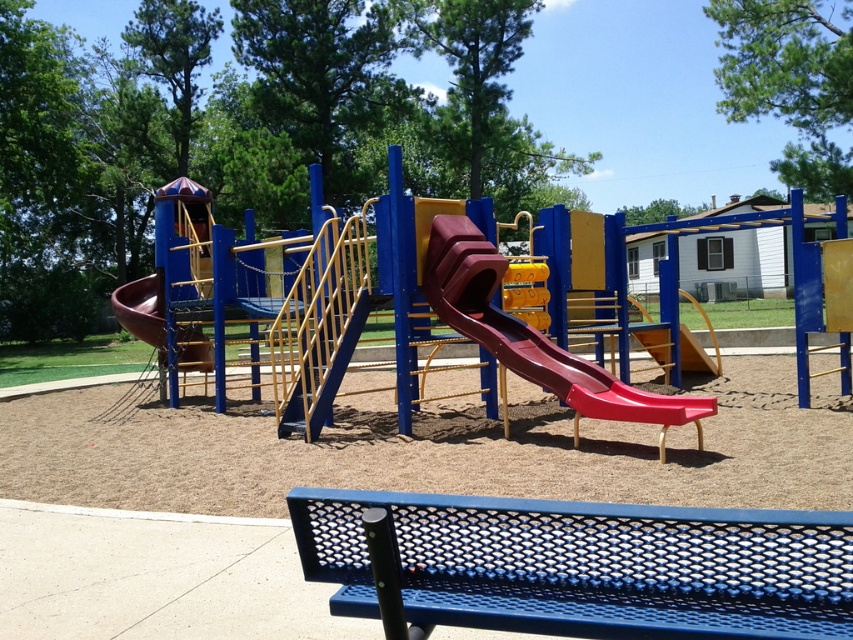
Identify the location of blue perforated metal bench at center. The height and width of the screenshot is (640, 853). (576, 564).

Is blue perforated metal bench at center below brown matte slide at left?

Yes, blue perforated metal bench at center is below brown matte slide at left.

Is point (807, 604) farther from viewer compared to point (138, 333)?

That is False.

Locate an element on the screen. This screenshot has width=853, height=640. blue perforated metal bench at center is located at coordinates (576, 564).

Is rubberized smooth slide at center wider than brown matte slide at left?

Yes, rubberized smooth slide at center is wider than brown matte slide at left.

The image size is (853, 640). What do you see at coordinates (531, 333) in the screenshot?
I see `rubberized smooth slide at center` at bounding box center [531, 333].

Is point (618, 403) less distant than point (120, 289)?

That is True.

At what (x,y) coordinates should I click in order to perform the action: click on rubberized smooth slide at center. Please return your answer as a coordinate pair (x, y). This screenshot has height=640, width=853. Looking at the image, I should click on (531, 333).

Can you confirm if blue perforated metal bench at center is shorter than rubberized smooth slide at center?

Indeed, blue perforated metal bench at center has a lesser height compared to rubberized smooth slide at center.

Is point (321, 557) more distant than point (437, 269)?

No.

Is point (746, 636) positioned after point (608, 392)?

No, (746, 636) is in front of (608, 392).

Locate an element on the screen. blue perforated metal bench at center is located at coordinates (576, 564).